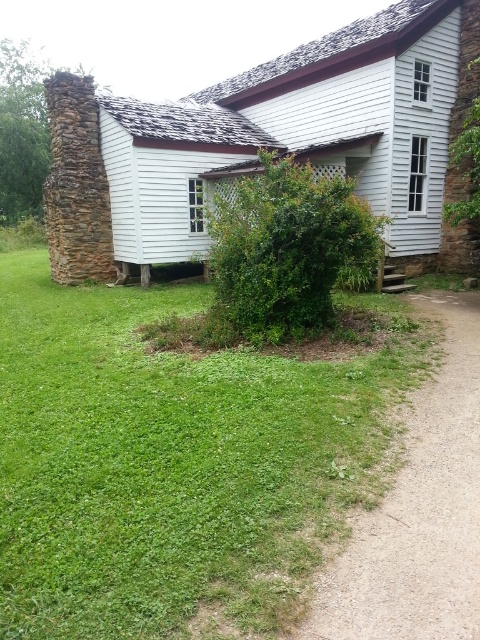
You are standing in the middle of the lawn looking towards the house. Which object is closer to you, the green grass at lower left or the white wooden cottage at left?

The green grass at lower left is closer to you because it is in front of the white wooden cottage at left, meaning the cottage is behind the grass.

Based on the photo, you are standing at the base of the wooden steps leading to the porch of the rustic house. You see two points marked on the ground in front of you. One is at coordinate point (411, 76) and the other is at point (407, 628). If you want to walk towards the point that is closer to the camera, which coordinate should you head towards?

You should head towards point (407, 628) because it is closer to the camera compared to point (411, 76), which is further away.